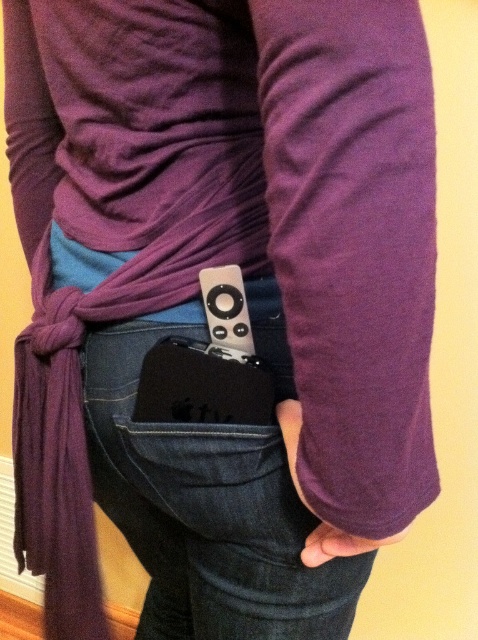
Question: Is denim at lower center closer to the viewer compared to satin black remote at center?

Choices:
 (A) no
 (B) yes

Answer: (B)

Question: Which of the following is the closest to the observer?

Choices:
 (A) (18, 339)
 (B) (226, 326)

Answer: (B)

Question: Is denim at lower center in front of purple fabric scarf at center?

Choices:
 (A) no
 (B) yes

Answer: (A)

Question: Does denim at lower center appear on the right side of purple fabric scarf at center?

Choices:
 (A) no
 (B) yes

Answer: (B)

Question: Which point is farther to the camera?

Choices:
 (A) (355, 552)
 (B) (247, 314)
 (C) (332, 545)
 (D) (164, 356)

Answer: (D)

Question: Among these points, which one is farthest from the camera?

Choices:
 (A) (318, 545)
 (B) (192, 536)
 (C) (203, 378)

Answer: (B)